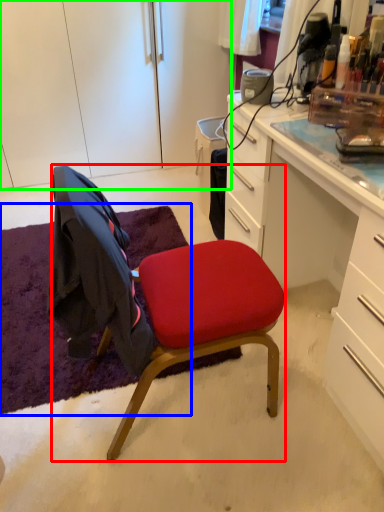
Question: Considering the real-world distances, which object is farthest from chair (highlighted by a red box)? mat (highlighted by a blue box) or cabinetry (highlighted by a green box)?

Choices:
 (A) mat
 (B) cabinetry

Answer: (B)